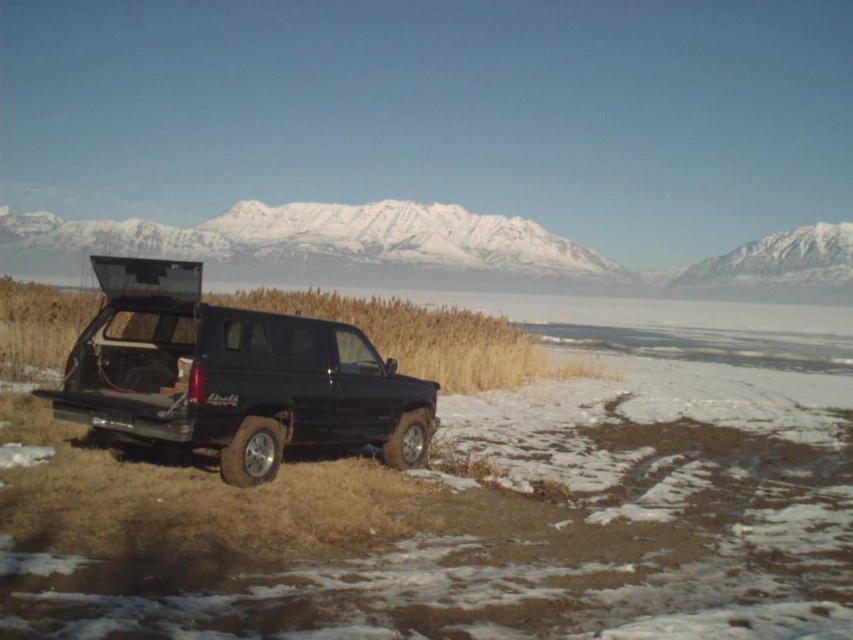
Between black matte truck at center and snowy white mountain at upper center, which one is positioned lower?

black matte truck at center

Consider the image. Is black matte truck at center above snowy white mountain at upper center?

No.

Who is more distant from viewer, [225,348] or [209,250]?

The point [209,250] is behind.

You are a GUI agent. You are given a task and a screenshot of the screen. Output one action in this format:
    pyautogui.click(x=<x>, y=<y>)
    Task: Click on the black matte truck at center
    
    Given the screenshot: What is the action you would take?
    pyautogui.click(x=233, y=376)